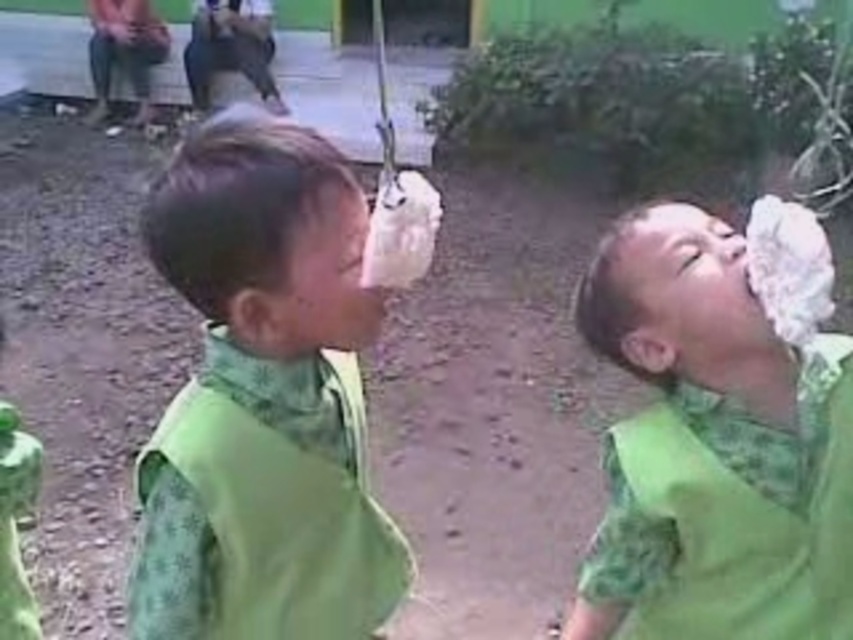
Question: Which point is farther from the camera taking this photo?

Choices:
 (A) coord(279,236)
 (B) coord(749,387)

Answer: (B)

Question: Is green fabric bib at center positioned behind green fabric shirt at center?

Choices:
 (A) no
 (B) yes

Answer: (A)

Question: Does green fabric bib at center have a larger size compared to green fabric shirt at center?

Choices:
 (A) no
 (B) yes

Answer: (A)

Question: Is green fabric bib at center above green fabric shirt at center?

Choices:
 (A) no
 (B) yes

Answer: (B)

Question: Which of the following is the farthest from the observer?

Choices:
 (A) (624, 259)
 (B) (363, 330)

Answer: (A)